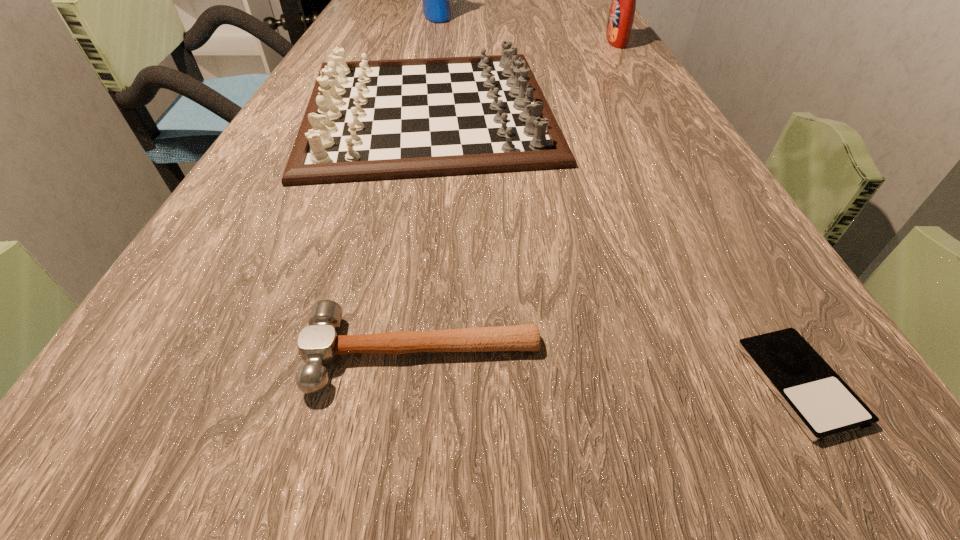
Where is `vacant position located on the front surface of the second farthest object`? vacant position located on the front surface of the second farthest object is located at coordinates (477, 41).

In order to click on blank space located on the front surface of the second farthest object in this screenshot , I will do `click(509, 41)`.

You are a GUI agent. You are given a task and a screenshot of the screen. Output one action in this format:
    pyautogui.click(x=<x>, y=<y>)
    Task: Click on the vacant space situated on the front of the third nearest object
    This screenshot has height=540, width=960.
    Given the screenshot: What is the action you would take?
    pyautogui.click(x=398, y=280)

The height and width of the screenshot is (540, 960). I want to click on vacant position located on the left of the hammer, so click(x=145, y=355).

Locate an element on the screen. This screenshot has width=960, height=540. free space located 0.070m on the left of the shortest object is located at coordinates (684, 383).

I want to click on object present at the far edge, so click(x=436, y=6).

You are a GUI agent. You are given a task and a screenshot of the screen. Output one action in this format:
    pyautogui.click(x=<x>, y=<y>)
    Task: Click on the object that is at the left edge
    The width and height of the screenshot is (960, 540).
    Given the screenshot: What is the action you would take?
    [x=374, y=120]

This screenshot has width=960, height=540. Find the location of `detergent located in the right edge section of the desktop`. detergent located in the right edge section of the desktop is located at coordinates (621, 16).

The width and height of the screenshot is (960, 540). In order to click on iPod situated at the right edge in this screenshot , I will do `click(823, 405)`.

This screenshot has width=960, height=540. In the image, there is a desktop. Find the location of `vacant area at the far edge`. vacant area at the far edge is located at coordinates (487, 5).